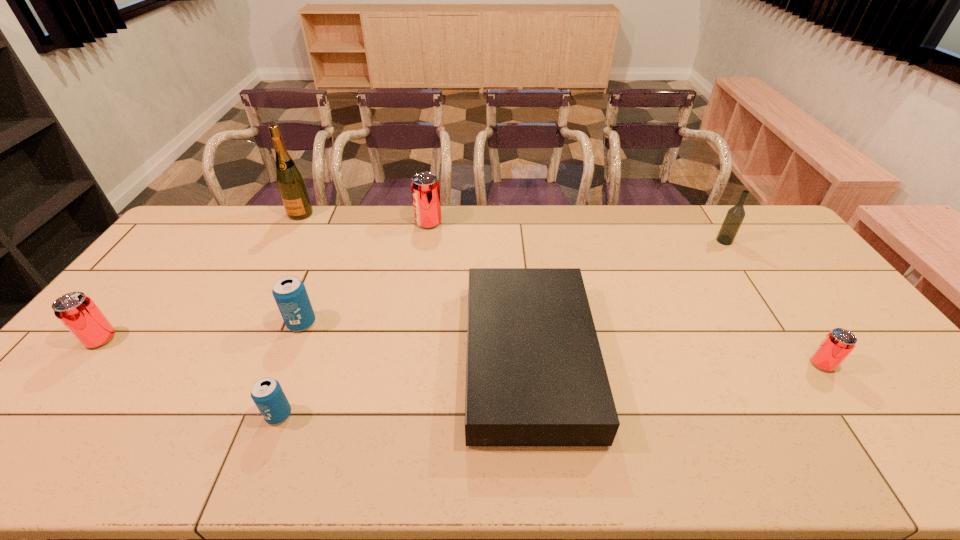
Where is `the seventh object from right to left`? The width and height of the screenshot is (960, 540). the seventh object from right to left is located at coordinates (291, 185).

At what (x,y) coordinates should I click in order to perform the action: click on wine bottle. Please return your answer as a coordinate pair (x, y). The width and height of the screenshot is (960, 540). Looking at the image, I should click on (291, 185).

The image size is (960, 540). I want to click on the sixth nearest object, so click(x=735, y=215).

The height and width of the screenshot is (540, 960). In order to click on black vodka in this screenshot , I will do `click(735, 215)`.

Where is `the second red soda can from left to right`? the second red soda can from left to right is located at coordinates (425, 188).

Find the location of a particular element. the fourth object from right to left is located at coordinates (425, 188).

Where is `the leftmost object`? This screenshot has height=540, width=960. the leftmost object is located at coordinates (76, 311).

Locate an element on the screen. This screenshot has height=540, width=960. the second biggest red soda can is located at coordinates (76, 311).

Where is `the bigger blue soda can`? the bigger blue soda can is located at coordinates (289, 292).

Image resolution: width=960 pixels, height=540 pixels. I want to click on the rightmost soda can, so click(837, 345).